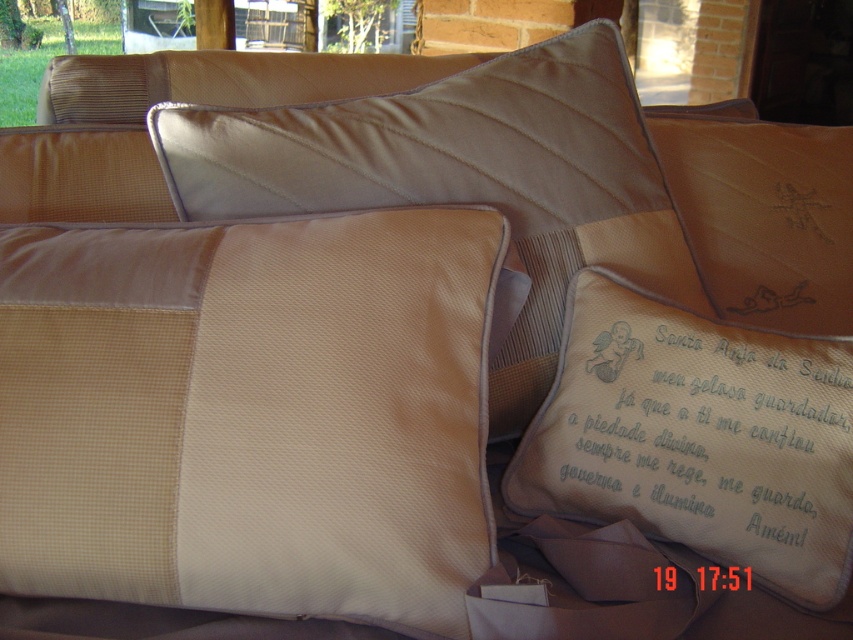
Based on the photo, can you confirm if satin beige pillow at center is thinner than satin embroidered pillow at center?

No.

Between point (326, 161) and point (811, 173), which one is positioned behind?

The point (811, 173) is more distant.

Between point (492, 371) and point (828, 204), which one is positioned behind?

The point (828, 204) is behind.

Locate an element on the screen. This screenshot has height=640, width=853. satin beige pillow at center is located at coordinates (465, 177).

Is beige fabric pillow at center taller than satin beige pillow at center?

No, beige fabric pillow at center is not taller than satin beige pillow at center.

Does point (345, 484) come behind point (556, 83)?

No, it is not.

Based on the photo, who is more distant from viewer, (437, 509) or (370, 205)?

The point (370, 205) is behind.

Where is `beige fabric pillow at center`? beige fabric pillow at center is located at coordinates (248, 413).

Does beige fabric pillow at center lie in front of satin embroidered pillow at center?

That is True.

Is beige fabric pillow at center behind satin embroidered pillow at center?

That is False.

Does point (477, 570) lie behind point (787, 198)?

No, it is in front of (787, 198).

Identify the location of beige fabric pillow at center. The height and width of the screenshot is (640, 853). (248, 413).